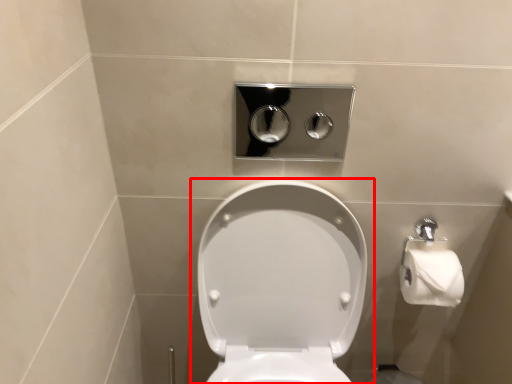
Question: From the image, what is the correct spatial relationship of toilet (annotated by the red box) in relation to dispenser?

Choices:
 (A) left
 (B) right

Answer: (A)